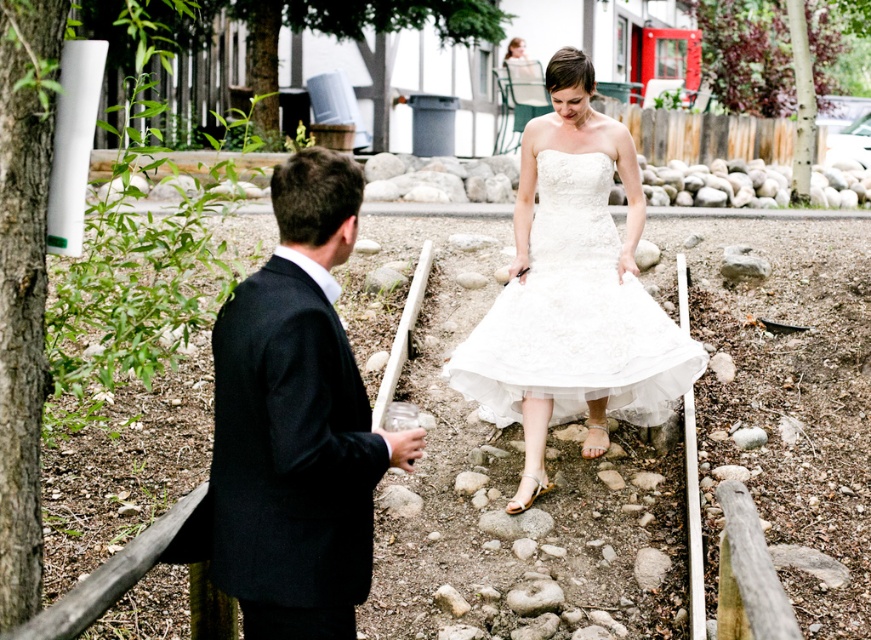
Question: Is black wool suit at left positioned at the back of white lace dress at center?

Choices:
 (A) no
 (B) yes

Answer: (A)

Question: Estimate the real-world distances between objects in this image. Which object is farther from the black wool suit at left?

Choices:
 (A) white satin dress at center
 (B) white lace dress at center

Answer: (B)

Question: Which object appears closest to the camera in this image?

Choices:
 (A) white satin dress at center
 (B) black wool suit at left
 (C) white lace dress at center

Answer: (B)

Question: Among these objects, which one is farthest from the camera?

Choices:
 (A) black wool suit at left
 (B) white satin dress at center
 (C) white lace dress at center

Answer: (C)

Question: Does black wool suit at left appear on the left side of white satin dress at center?

Choices:
 (A) no
 (B) yes

Answer: (B)

Question: Does white satin dress at center have a greater width compared to white lace dress at center?

Choices:
 (A) yes
 (B) no

Answer: (A)